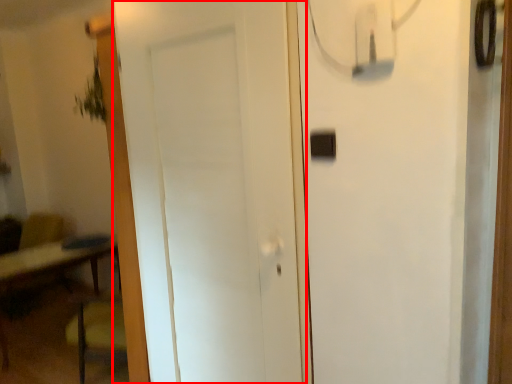
Question: From the image's perspective, what is the correct spatial positioning of door (annotated by the red box) in reference to light switch?

Choices:
 (A) above
 (B) below

Answer: (B)